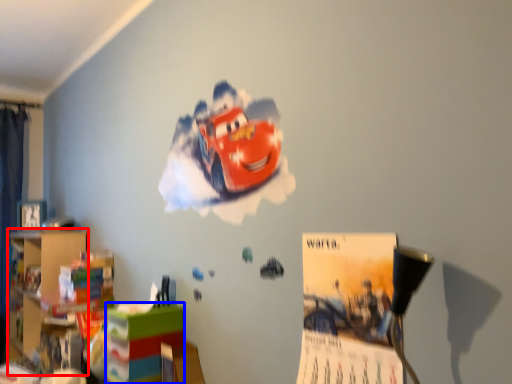
Question: Which object is closer to the camera taking this photo, bookshelf (highlighted by a red box) or shelf (highlighted by a blue box)?

Choices:
 (A) bookshelf
 (B) shelf

Answer: (B)